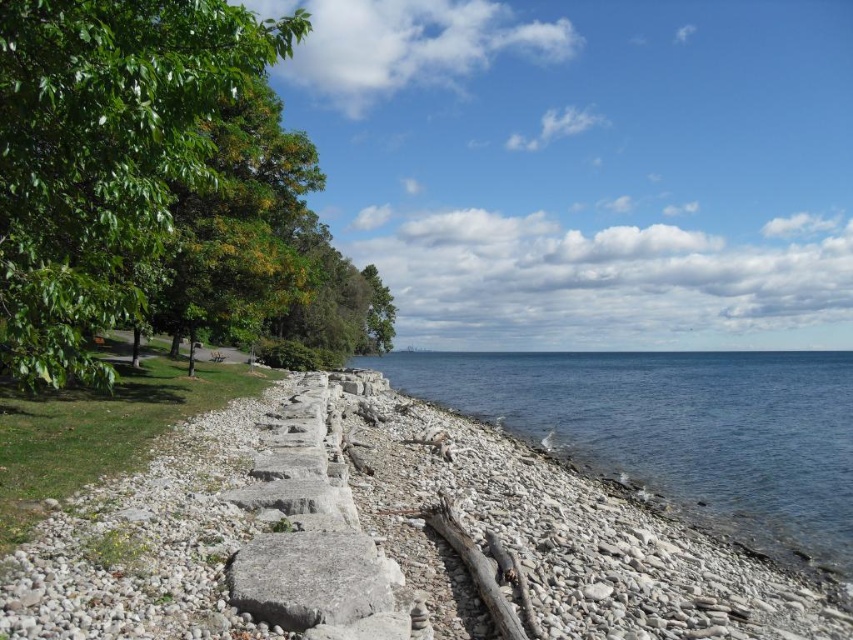
Question: Which of the following is the farthest from the observer?

Choices:
 (A) green leafy tree at left
 (B) blue water at center
 (C) white gravel at lower center

Answer: (B)

Question: Can you confirm if white gravel at lower center is positioned to the left of blue water at center?

Choices:
 (A) yes
 (B) no

Answer: (A)

Question: Which object is the farthest from the blue water at center?

Choices:
 (A) white gravel at lower center
 (B) green leafy tree at left

Answer: (B)

Question: Which point is closer to the camera?

Choices:
 (A) (842, 557)
 (B) (393, 403)
 (C) (3, 326)

Answer: (C)

Question: Can you confirm if white gravel at lower center is positioned to the right of blue water at center?

Choices:
 (A) no
 (B) yes

Answer: (A)

Question: Does white gravel at lower center have a larger size compared to green leafy tree at left?

Choices:
 (A) yes
 (B) no

Answer: (B)